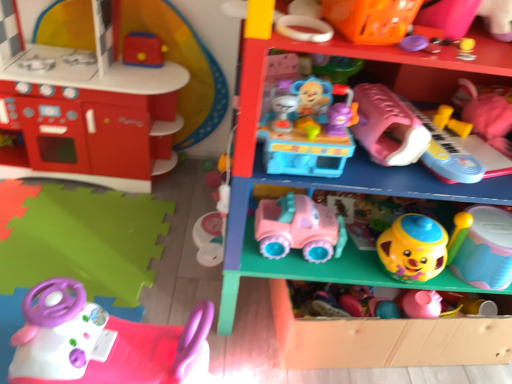
Question: Is pink plastic steering wheel at lower left, which ranks as the third toy in left-to-right order, outside pink plastic toy car at center, placed as the 1th shelf when sorted from top to bottom?

Choices:
 (A) yes
 (B) no

Answer: (A)

Question: Is pink plastic steering wheel at lower left, which ranks as the third toy in left-to-right order, far away from pink plastic toy car at center, which ranks as the 2th shelf in bottom-to-top order?

Choices:
 (A) yes
 (B) no

Answer: (B)

Question: Is pink plastic steering wheel at lower left, marked as the ninth toy in a right-to-left arrangement, smaller than pink plastic toy car at center, placed as the 1th shelf when sorted from top to bottom?

Choices:
 (A) no
 (B) yes

Answer: (B)

Question: Considering the relative sizes of pink plastic steering wheel at lower left, which ranks as the third toy in left-to-right order, and pink plastic toy car at center, placed as the 1th shelf when sorted from top to bottom, in the image provided, is pink plastic steering wheel at lower left, which ranks as the third toy in left-to-right order, wider than pink plastic toy car at center, placed as the 1th shelf when sorted from top to bottom,?

Choices:
 (A) yes
 (B) no

Answer: (B)

Question: Is pink plastic steering wheel at lower left, which ranks as the third toy in left-to-right order, oriented towards pink plastic toy car at center, placed as the 1th shelf when sorted from top to bottom?

Choices:
 (A) no
 (B) yes

Answer: (A)

Question: Is yellow plastic cup at center right, the eighth toy viewed from the left, spatially inside smooth yellow plastic cup at lower right, which ranks as the second toy in right-to-left order, or outside of it?

Choices:
 (A) inside
 (B) outside

Answer: (B)

Question: Is yellow plastic cup at center right, the 4th toy in the right-to-left sequence, in front of or behind smooth yellow plastic cup at lower right, acting as the 10th toy starting from the left, in the image?

Choices:
 (A) front
 (B) behind

Answer: (A)

Question: Considering the positions of yellow plastic cup at center right, the eighth toy viewed from the left, and smooth yellow plastic cup at lower right, which ranks as the second toy in right-to-left order, in the image, is yellow plastic cup at center right, the eighth toy viewed from the left, bigger or smaller than smooth yellow plastic cup at lower right, which ranks as the second toy in right-to-left order,?

Choices:
 (A) small
 (B) big

Answer: (A)

Question: From their relative heights in the image, would you say yellow plastic cup at center right, the eighth toy viewed from the left, is taller or shorter than smooth yellow plastic cup at lower right, which ranks as the second toy in right-to-left order?

Choices:
 (A) short
 (B) tall

Answer: (B)

Question: Is rubberized yellow ball at upper right, which appears as the fifth toy when viewed from the right, wider or thinner than yellow plastic cup at center right, the eighth toy viewed from the left?

Choices:
 (A) thin
 (B) wide

Answer: (B)

Question: From a real-world perspective, is rubberized yellow ball at upper right, the seventh toy viewed from the left, above or below yellow plastic cup at center right, the 4th toy in the right-to-left sequence?

Choices:
 (A) below
 (B) above

Answer: (B)

Question: In the image, is rubberized yellow ball at upper right, the seventh toy viewed from the left, on the left side or the right side of yellow plastic cup at center right, the 4th toy in the right-to-left sequence?

Choices:
 (A) right
 (B) left

Answer: (B)

Question: From the image's perspective, is rubberized yellow ball at upper right, which appears as the fifth toy when viewed from the right, above or below yellow plastic cup at center right, the eighth toy viewed from the left?

Choices:
 (A) above
 (B) below

Answer: (A)

Question: Is smooth yellow plastic cup at lower right, which ranks as the second toy in right-to-left order, spatially inside purple plastic lid at upper center, which is counted as the sixth toy, starting from the left, or outside of it?

Choices:
 (A) inside
 (B) outside

Answer: (B)

Question: Is smooth yellow plastic cup at lower right, acting as the 10th toy starting from the left, taller or shorter than purple plastic lid at upper center, which is counted as the sixth toy, starting from the left?

Choices:
 (A) short
 (B) tall

Answer: (B)